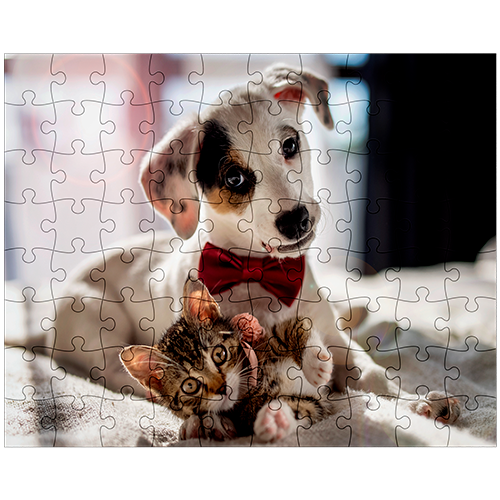
Find the location of a particular element. puzzle pieces with part of the bow on them is located at coordinates (188, 256), (209, 238), (218, 269), (271, 271), (309, 271), (289, 313).